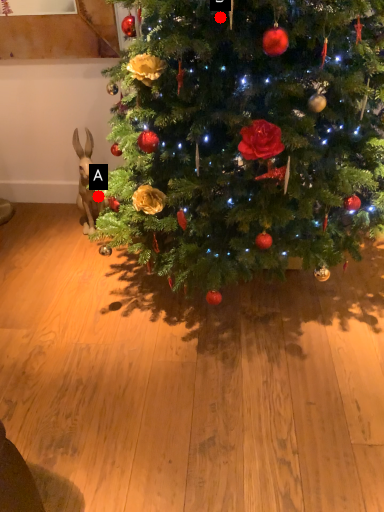
Question: Two points are circled on the image, labeled by A and B beside each circle. Which point is further to the camera?

Choices:
 (A) A is further
 (B) B is further

Answer: (A)